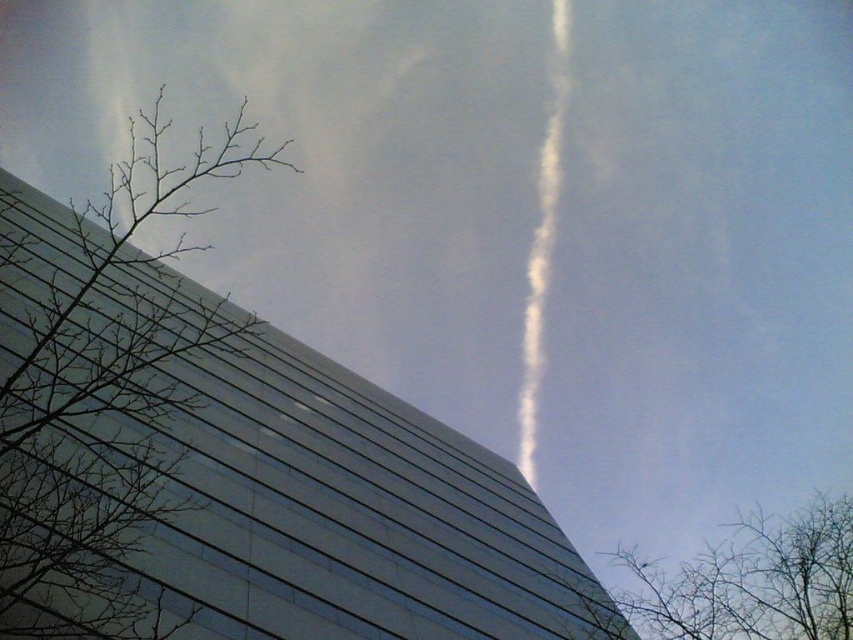
Question: Which of the following is the closest to the observer?

Choices:
 (A) (787, 586)
 (B) (239, 116)
 (C) (560, 176)

Answer: (A)

Question: Based on their relative distances, which object is nearer to the bare branches at left?

Choices:
 (A) bare branches at lower right
 (B) white fluffy smoke at upper center

Answer: (B)

Question: Is bare branches at left positioned at the back of white fluffy smoke at upper center?

Choices:
 (A) yes
 (B) no

Answer: (B)

Question: Is bare branches at lower right thinner than white fluffy smoke at upper center?

Choices:
 (A) yes
 (B) no

Answer: (B)

Question: Is bare branches at left below bare branches at lower right?

Choices:
 (A) yes
 (B) no

Answer: (B)

Question: Which of these objects is positioned closest to the bare branches at left?

Choices:
 (A) white fluffy smoke at upper center
 (B) bare branches at lower right

Answer: (A)